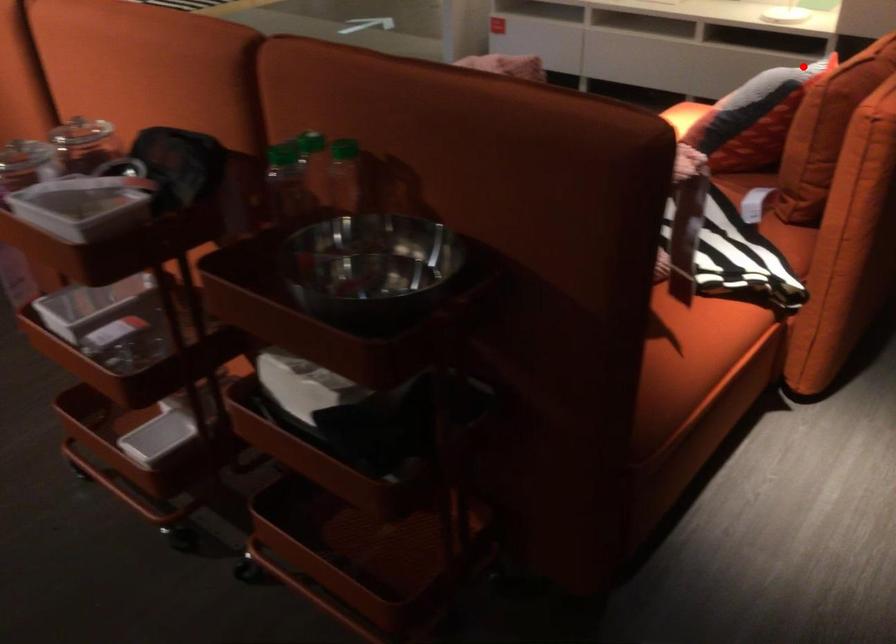
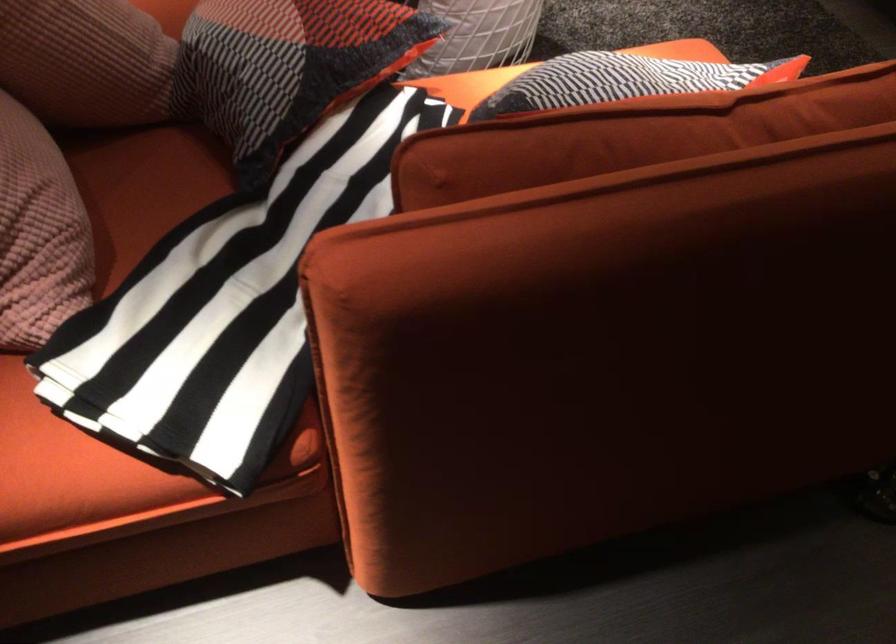
Find the pixel in the second image that matches the highlighted location in the first image.

(623, 80)